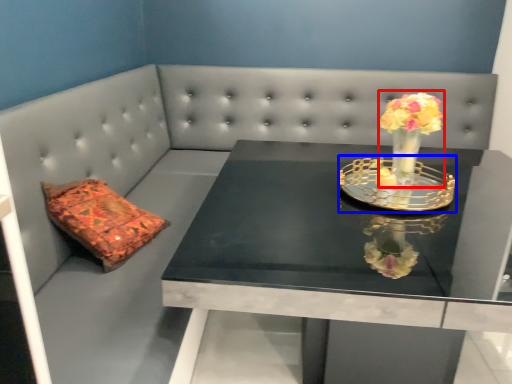
Question: Among these objects, which one is farthest to the camera, floral arrangement (highlighted by a red box) or candle holder (highlighted by a blue box)?

Choices:
 (A) floral arrangement
 (B) candle holder

Answer: (A)